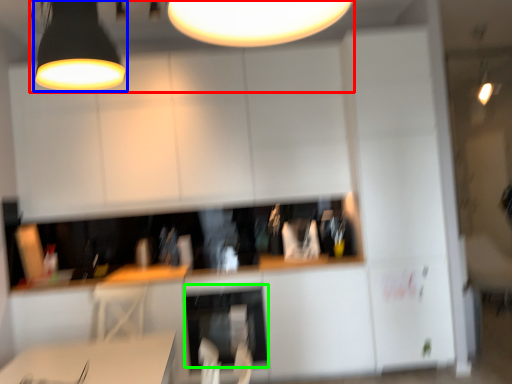
Question: Estimate the real-world distances between objects in this image. Which object is closer to lamp (highlighted by a red box), lamp (highlighted by a blue box) or dish washer (highlighted by a green box)?

Choices:
 (A) lamp
 (B) dish washer

Answer: (A)